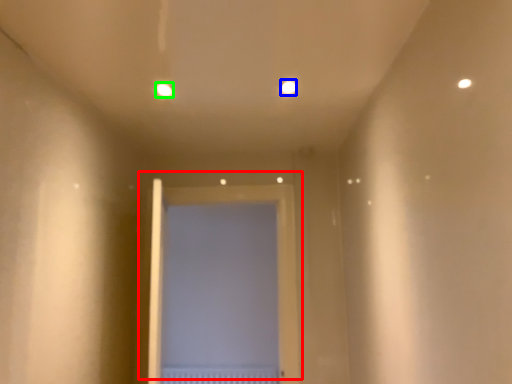
Question: Which is nearer to the door (highlighted by a red box)? light (highlighted by a blue box) or light (highlighted by a green box).

Choices:
 (A) light
 (B) light

Answer: (A)